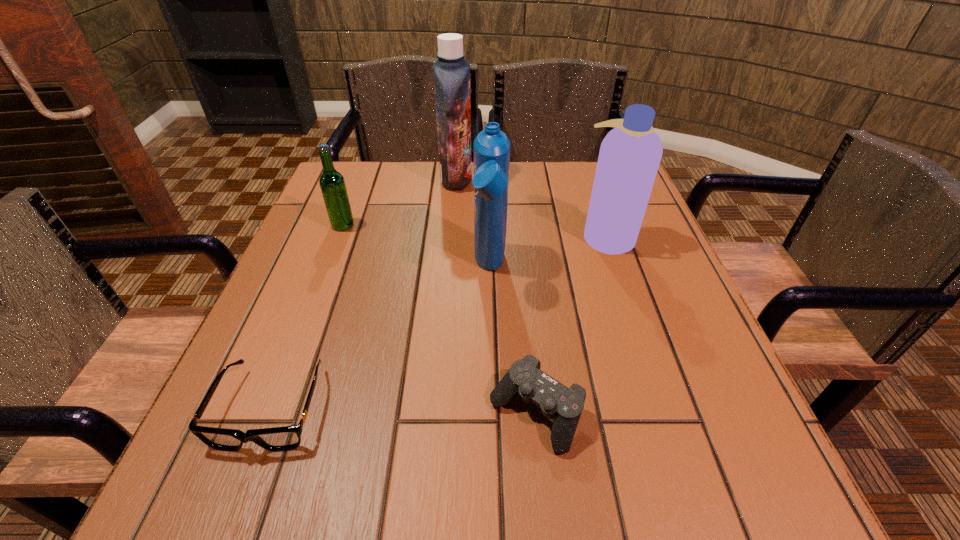
In the image, there is a desktop. At what (x,y) coordinates should I click in order to perform the action: click on free region at the far edge. Please return your answer as a coordinate pair (x, y). Image resolution: width=960 pixels, height=540 pixels. Looking at the image, I should click on (558, 197).

Find the location of a particular element. The width and height of the screenshot is (960, 540). vacant area at the near edge of the desktop is located at coordinates (537, 454).

The image size is (960, 540). Find the location of `free space at the left edge`. free space at the left edge is located at coordinates (363, 249).

At what (x,y) coordinates should I click in order to perform the action: click on free space at the right edge of the desktop. Please return your answer as a coordinate pair (x, y). This screenshot has width=960, height=540. Looking at the image, I should click on (671, 301).

This screenshot has width=960, height=540. In order to click on blank space at the far left corner in this screenshot , I will do `click(347, 176)`.

The height and width of the screenshot is (540, 960). I want to click on free spot between the second shampoo from left to right and the fourth tallest object, so click(417, 247).

Where is `vacant space in between the control and the rightmost object`? The height and width of the screenshot is (540, 960). vacant space in between the control and the rightmost object is located at coordinates (571, 325).

You are a GUI agent. You are given a task and a screenshot of the screen. Output one action in this format:
    pyautogui.click(x=<x>, y=<y>)
    Task: Click on the blank region between the control and the second shampoo from left to right
    The height and width of the screenshot is (540, 960).
    Given the screenshot: What is the action you would take?
    pyautogui.click(x=513, y=341)

In order to click on vacant area that lies between the third shortest object and the farthest object in this screenshot , I will do `click(399, 202)`.

You are a GUI agent. You are given a task and a screenshot of the screen. Output one action in this format:
    pyautogui.click(x=<x>, y=<y>)
    Task: Click on the unoccupied position between the control and the second shampoo from left to right
    
    Given the screenshot: What is the action you would take?
    pyautogui.click(x=513, y=341)